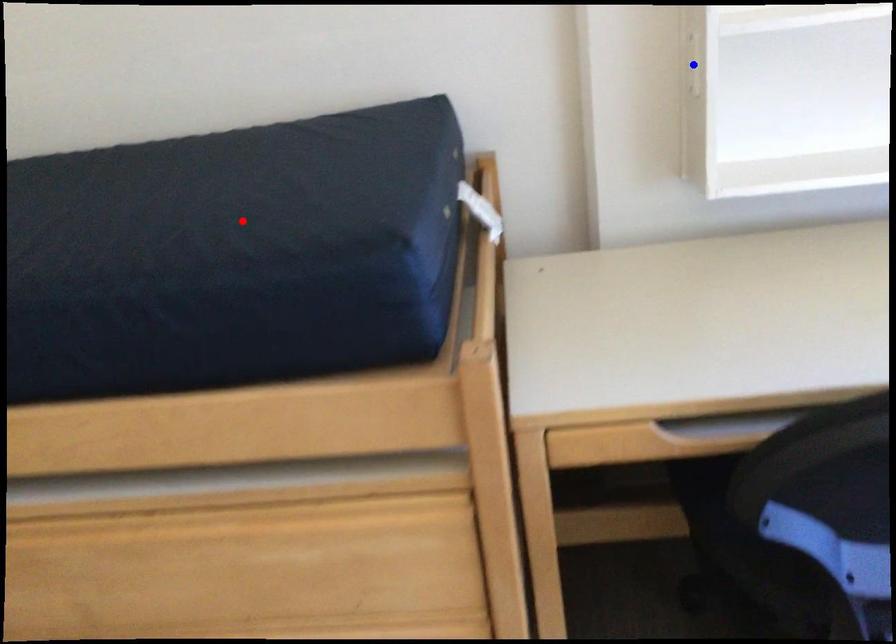
Question: Two points are marked on the image. Which point is closer to the camera?

Choices:
 (A) Blue point is closer.
 (B) Red point is closer.

Answer: (B)